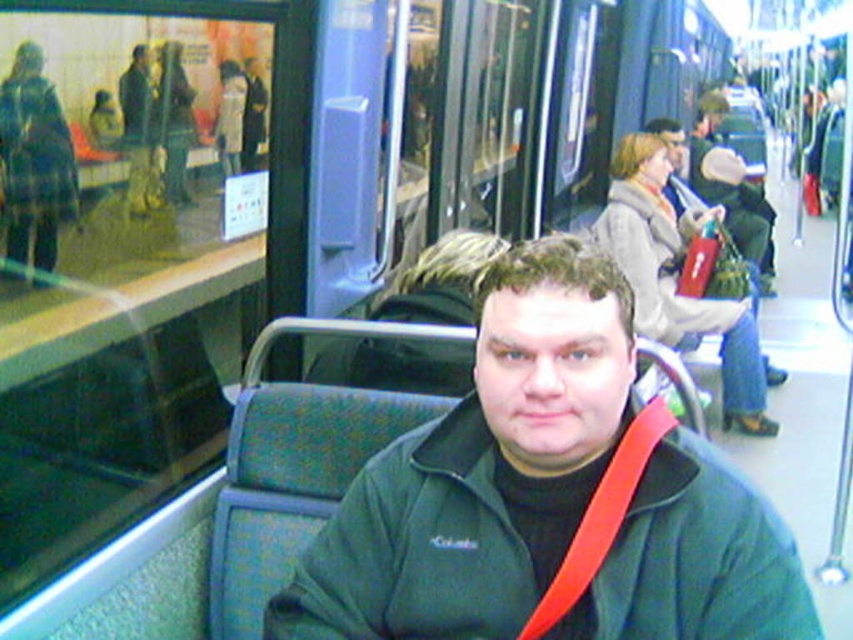
You are a safety inspector checking the seating area of a train car. You notice the green fleece jacket at center and the red fabric seatbelt at center. Which object is positioned lower in the seating area?

The green fleece jacket at center is located below the red fabric seatbelt at center, so it is positioned lower in the seating area.

You are a safety inspector checking seatbelt lengths on a train. You observe the red fabric seatbelt at center and the matte green jacket at center. Which object is shorter in length?

The red fabric seatbelt at center is shorter than the matte green jacket at center.

You are a photographer trying to capture a closeup of both the green fleece jacket at center and the matte green jacket at center in the scene. Since you want to ensure both are fully visible in the frame, which jacket should you adjust your camera angle to focus on first to account for their size difference?

The green fleece jacket at center has a lesser width compared to the matte green jacket at center, so you should focus on the matte green jacket at center first since it is wider and requires more space in the frame to ensure it fits properly before adjusting for the smaller one.